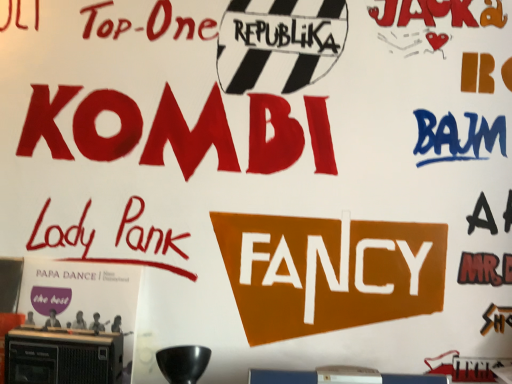
Measure the distance between orange plastic stereo at lower left and camera.

The distance of orange plastic stereo at lower left from camera is 38.42 inches.

Image resolution: width=512 pixels, height=384 pixels. In order to click on orange plastic stereo at lower left in this screenshot , I will do `click(62, 357)`.

What do you see at coordinates (62, 357) in the screenshot? This screenshot has width=512, height=384. I see `orange plastic stereo at lower left` at bounding box center [62, 357].

Locate an element on the screen. orange plastic stereo at lower left is located at coordinates 62,357.